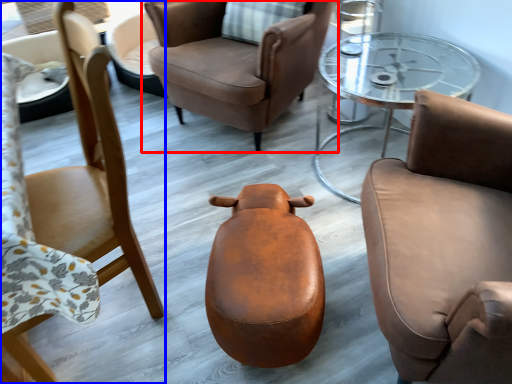
Question: Which object appears farthest to the camera in this image, chair (highlighted by a red box) or chair (highlighted by a blue box)?

Choices:
 (A) chair
 (B) chair

Answer: (A)